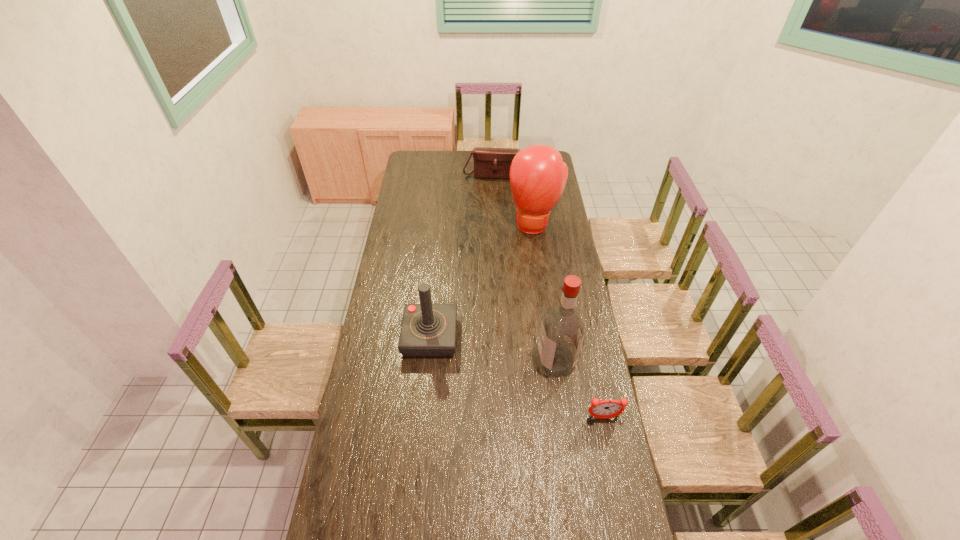
Find the location of a particular element. joystick is located at coordinates (428, 330).

The image size is (960, 540). What are the coordinates of `the nearest object` in the screenshot? It's located at (608, 408).

The image size is (960, 540). Find the location of `the shortest object`. the shortest object is located at coordinates (608, 408).

Find the location of a particular element. boxing glove is located at coordinates (538, 175).

Identify the location of liquor. This screenshot has height=540, width=960. 562,331.

Where is `shoulder bag`? The height and width of the screenshot is (540, 960). shoulder bag is located at coordinates (495, 163).

This screenshot has height=540, width=960. I want to click on the farthest object, so click(495, 163).

The image size is (960, 540). I want to click on blank space located on the rectangular base of the joystick, so click(420, 439).

I want to click on free space located on the front-facing side of the shortest object, so pos(618,492).

Find the location of a particular element. Image resolution: width=960 pixels, height=540 pixels. vacant space located on the striking surface of the fourth nearest object is located at coordinates (531, 271).